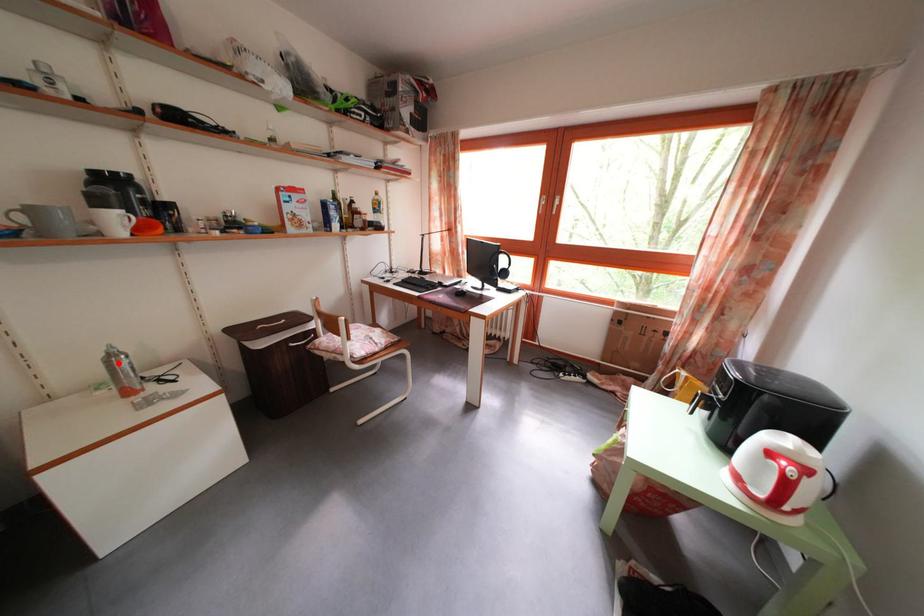
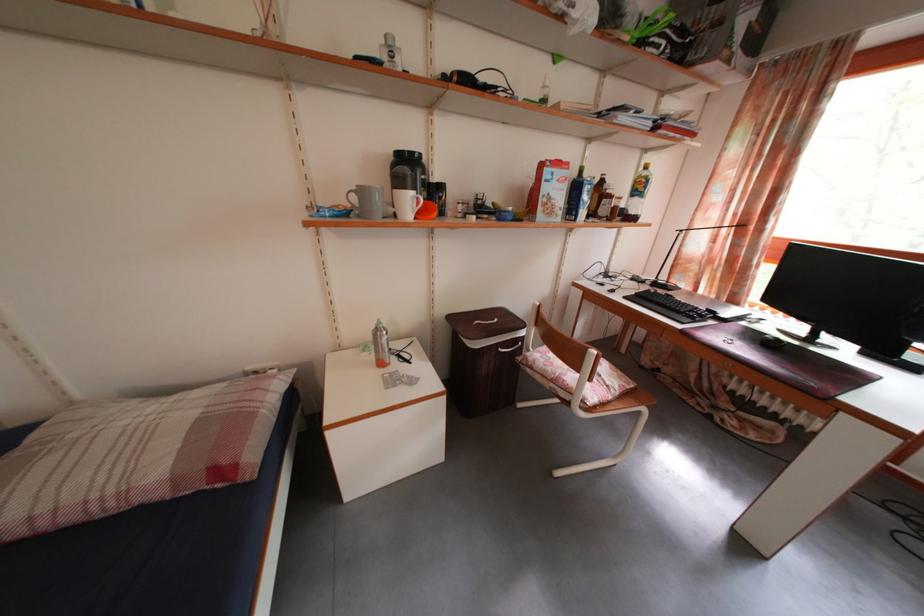
Locate, in the second image, the point that corresponds to the highlighted location in the first image.

(384, 338)